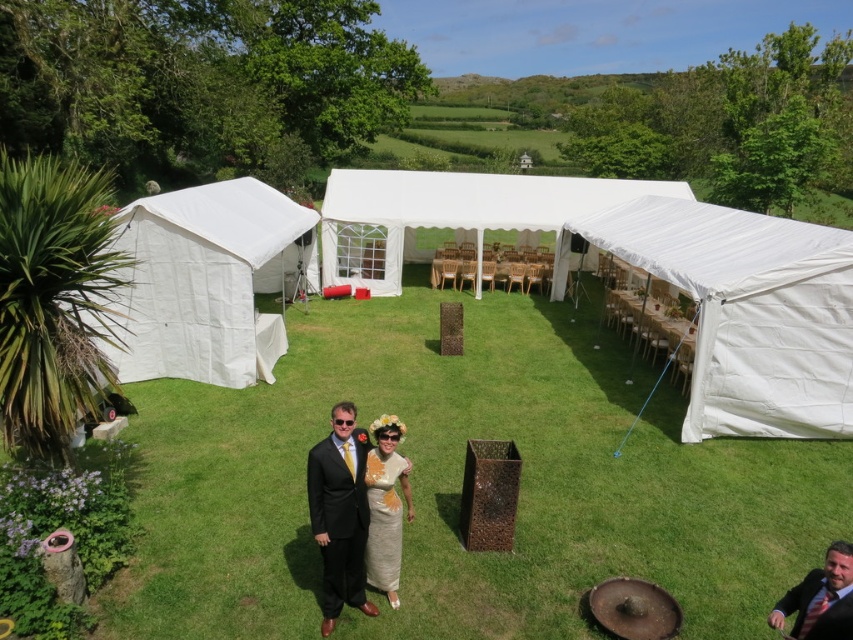
Between white canvas tent at left and matte black suit at center, which one is positioned lower?

Positioned lower is matte black suit at center.

Can you confirm if white canvas tent at left is thinner than matte black suit at center?

Indeed, white canvas tent at left has a lesser width compared to matte black suit at center.

Is point (166, 264) closer to viewer compared to point (339, 444)?

No.

Find the location of a particular element. This screenshot has width=853, height=640. white canvas tent at left is located at coordinates (202, 282).

Is point (756, 387) more distant than point (282, 225)?

No, (756, 387) is closer to viewer.

Can you confirm if white fabric tent at right is positioned to the left of white canvas tent at left?

In fact, white fabric tent at right is to the right of white canvas tent at left.

Where is `white fabric tent at right`? Image resolution: width=853 pixels, height=640 pixels. white fabric tent at right is located at coordinates (747, 310).

You are a GUI agent. You are given a task and a screenshot of the screen. Output one action in this format:
    pyautogui.click(x=<x>, y=<y>)
    Task: Click on the white fabric tent at right
    This screenshot has width=853, height=640.
    Given the screenshot: What is the action you would take?
    pyautogui.click(x=747, y=310)

Which is above, white canvas tent at left or white fabric canopy at center?

white fabric canopy at center

Can you confirm if white canvas tent at left is thinner than white fabric canopy at center?

Yes, white canvas tent at left is thinner than white fabric canopy at center.

Which is behind, point (169, 321) or point (374, 285)?

The point (374, 285) is behind.

The image size is (853, 640). What are the coordinates of `white canvas tent at left` in the screenshot? It's located at (202, 282).